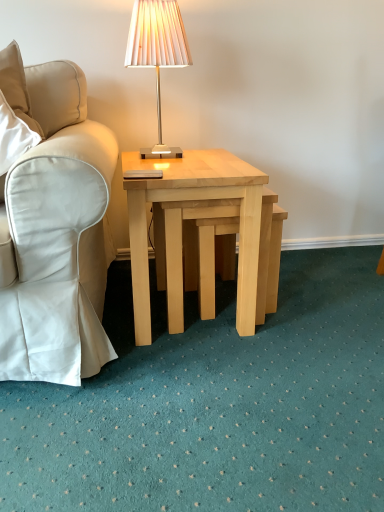
You are a GUI agent. You are given a task and a screenshot of the screen. Output one action in this format:
    pyautogui.click(x=<x>, y=<y>)
    Task: Click on the vacant area that lies in front of natural wood stool at center
    
    Given the screenshot: What is the action you would take?
    pyautogui.click(x=264, y=346)